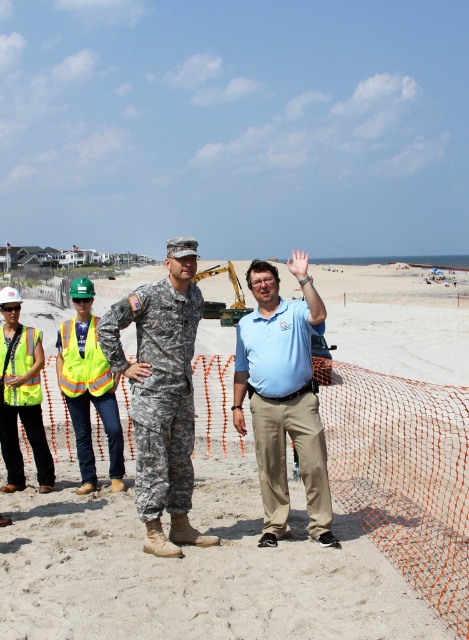
Which is above, sandy beach at center or camouflage fabric uniform at center?

sandy beach at center

Is sandy beach at center to the left of camouflage fabric uniform at center from the viewer's perspective?

Incorrect, sandy beach at center is not on the left side of camouflage fabric uniform at center.

You are a GUI agent. You are given a task and a screenshot of the screen. Output one action in this format:
    pyautogui.click(x=<x>, y=<y>)
    Task: Click on the sandy beach at center
    
    Given the screenshot: What is the action you would take?
    pyautogui.click(x=259, y=497)

Where is `sandy beach at center`? sandy beach at center is located at coordinates (259, 497).

Between light blue shirt at center and reflective yellow vest at left, which one has more height?

Standing taller between the two is light blue shirt at center.

Which is behind, point (301, 396) or point (0, 385)?

The point (0, 385) is more distant.

Locate an element on the screen. The image size is (469, 640). light blue shirt at center is located at coordinates (282, 396).

Based on the photo, which of these two, camouflage fabric uniform at center or reflective yellow vest at left, stands taller?

camouflage fabric uniform at center is taller.

Is camouflage fabric uniform at center above reflective yellow vest at left?

Correct, camouflage fabric uniform at center is located above reflective yellow vest at left.

Is point (166, 264) farther from camera compared to point (14, 433)?

No, it is not.

At what (x,y) coordinates should I click in order to perform the action: click on camouflage fabric uniform at center. Please return your answer as a coordinate pair (x, y). The width and height of the screenshot is (469, 640). Looking at the image, I should click on (161, 394).